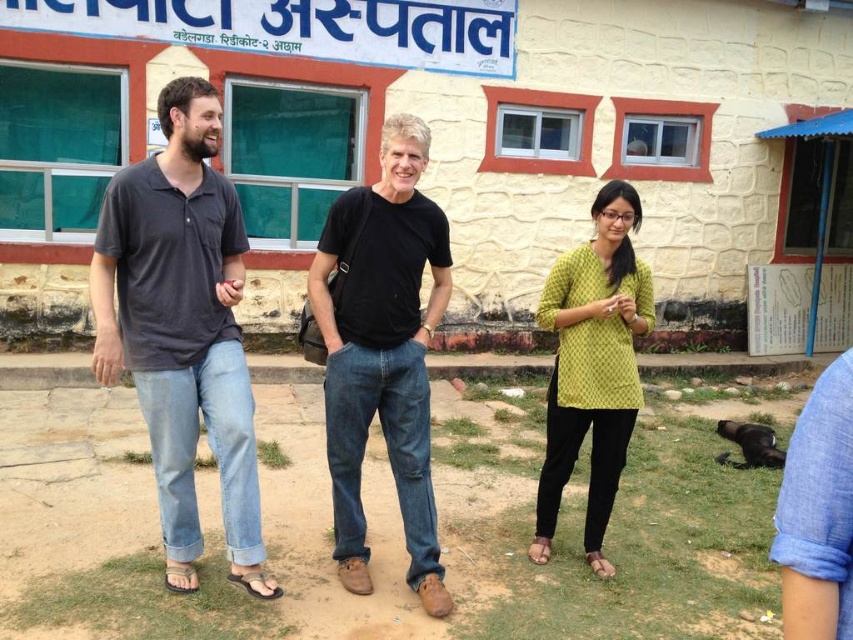
Is dark gray cotton shirt at left further to camera compared to yellow printed top at center?

That is False.

Is dark gray cotton shirt at left thinner than yellow printed top at center?

In fact, dark gray cotton shirt at left might be wider than yellow printed top at center.

Does point (195, 396) lie behind point (590, 548)?

No.

Find the location of a particular element. The image size is (853, 640). dark gray cotton shirt at left is located at coordinates (183, 328).

Can you confirm if dark gray cotton shirt at left is positioned to the left of black cotton t-shirt at center?

Correct, you'll find dark gray cotton shirt at left to the left of black cotton t-shirt at center.

Is dark gray cotton shirt at left bigger than black cotton t-shirt at center?

No.

Describe the element at coordinates (183, 328) in the screenshot. I see `dark gray cotton shirt at left` at that location.

This screenshot has width=853, height=640. What are the coordinates of `dark gray cotton shirt at left` in the screenshot? It's located at (183, 328).

Which is behind, point (352, 589) or point (612, 484)?

Positioned behind is point (612, 484).

You are a GUI agent. You are given a task and a screenshot of the screen. Output one action in this format:
    pyautogui.click(x=<x>, y=<y>)
    Task: Click on the black cotton t-shirt at center
    
    Given the screenshot: What is the action you would take?
    tap(381, 352)